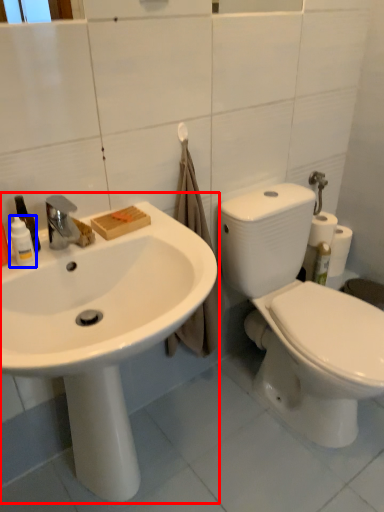
Question: Which object is closer to the camera taking this photo, sink (highlighted by a red box) or toiletry (highlighted by a blue box)?

Choices:
 (A) sink
 (B) toiletry

Answer: (A)